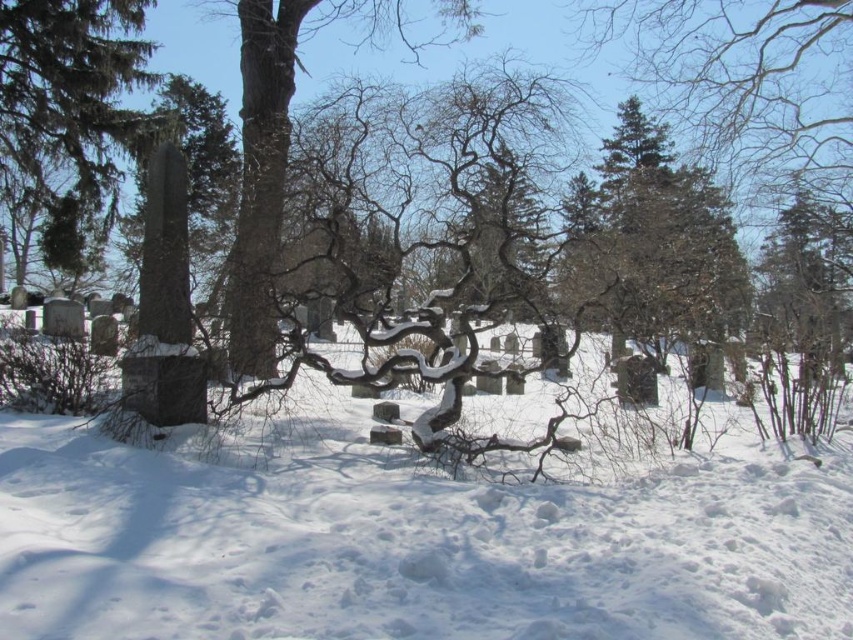
You are standing in the winter cemetery and notice the white powdery snow at center and the smooth gray stone at center. Which object covers a smaller area?

The white powdery snow at center has a lesser width compared to the smooth gray stone at center, so it covers a smaller area.

You are standing in the winter cemetery scene. You see a point marked at coordinates (408, 540). What is located at that point?

The point at coordinates (408, 540) marks white powdery snow at center.

Looking at this image, you are standing in the winter cemetery scene and want to place a 1.5 meter wide decorative stone between the white powdery snow at center and the smooth gray stone at center. Is there enough space between them to fit the stone?

The distance between the white powdery snow at center and the smooth gray stone at center is 7.09 meters. Since the decorative stone is only 1.5 meters wide, there is sufficient space to place it between them.